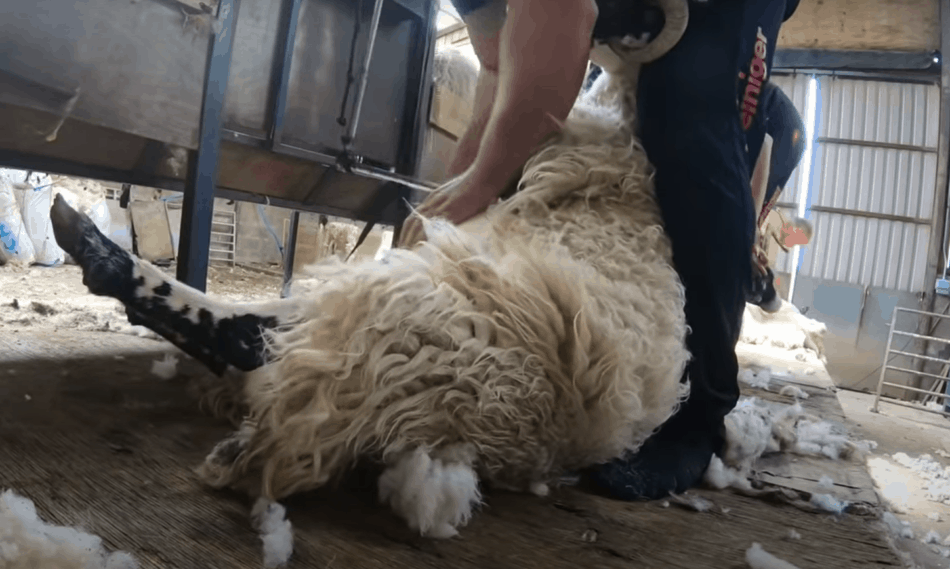
Where is `semi-closed doors`? This screenshot has height=569, width=950. semi-closed doors is located at coordinates (863, 121).